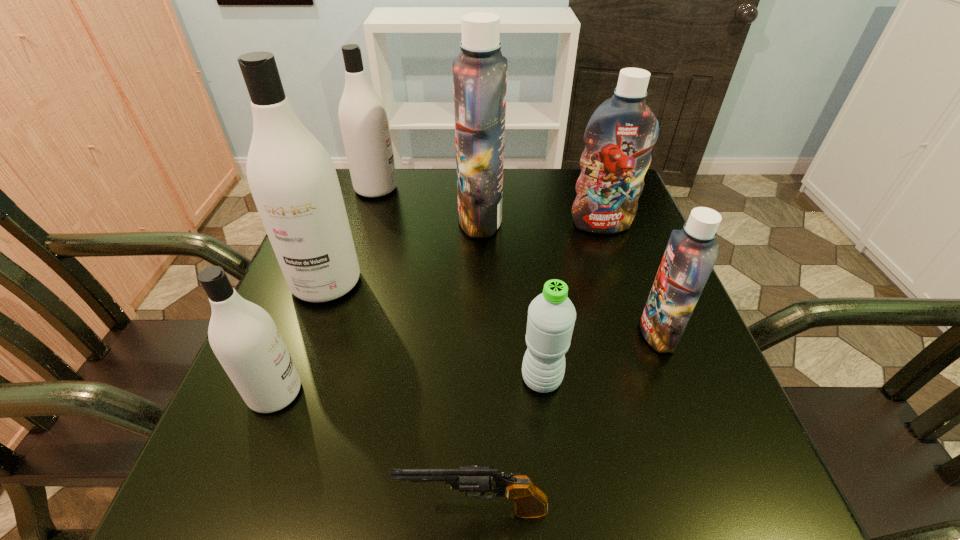
Find the location of `water bottle`. water bottle is located at coordinates (551, 315).

This screenshot has width=960, height=540. Identify the location of the seventh tallest object. (x=551, y=315).

The image size is (960, 540). I want to click on black gun, so click(530, 502).

Locate an element on the screen. the nearest object is located at coordinates (530, 502).

Locate an element on the screen. The width and height of the screenshot is (960, 540). free region located on the front label of the fourth shampoo from left to right is located at coordinates (362, 219).

Locate an element on the screen. This screenshot has height=540, width=960. free region located 0.120m on the front label of the fourth shampoo from left to right is located at coordinates (410, 219).

You are a GUI agent. You are given a task and a screenshot of the screen. Output one action in this format:
    pyautogui.click(x=<x>, y=<y>)
    Task: Click on the vacant space situated on the front label of the fourth shampoo from left to right
    The image size is (960, 540).
    Given the screenshot: What is the action you would take?
    pyautogui.click(x=398, y=219)

Where is `vacant space located on the front-facing side of the fourth farthest object`? Image resolution: width=960 pixels, height=540 pixels. vacant space located on the front-facing side of the fourth farthest object is located at coordinates (285, 396).

Identify the location of vacant point located on the front-facing side of the second biggest white shampoo. This screenshot has width=960, height=540. (442, 188).

Where is `free location located 0.100m on the front label of the second smallest blue shampoo`? free location located 0.100m on the front label of the second smallest blue shampoo is located at coordinates point(614,263).